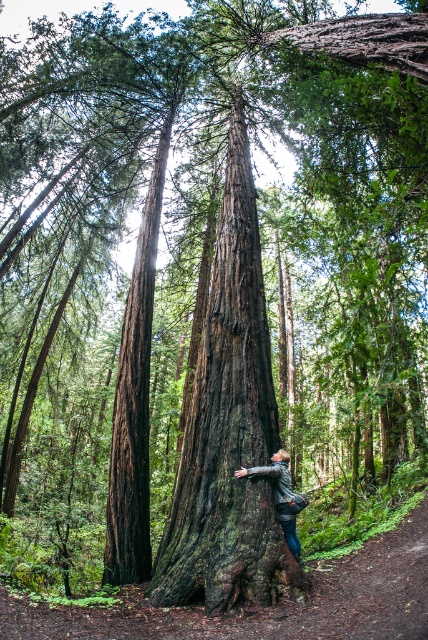
You are standing in the forest and see the dark brown rough bark at center and the leather jacket at center. Which object is closer to you?

The dark brown rough bark at center is closer to you because it is in front of the leather jacket at center.

You are a photographer standing in front of the dark brown bark tree trunk at center and the leather jacket at center. You want to take a photo that includes both objects in the frame. Which object should you focus on first to ensure both are in the shot?

The dark brown bark tree trunk at center is not as tall as the leather jacket at center, so you should focus on the leather jacket at center first to ensure both are in the frame.

You are a hiker who wants to take a photo of the leather jacket at center and the dark brown rough bark at center together in the same frame. Based on their positions, can you tell me which one is closer to the camera?

The dark brown rough bark at center is positioned under the leather jacket at center, so the leather jacket at center is closer to the camera.